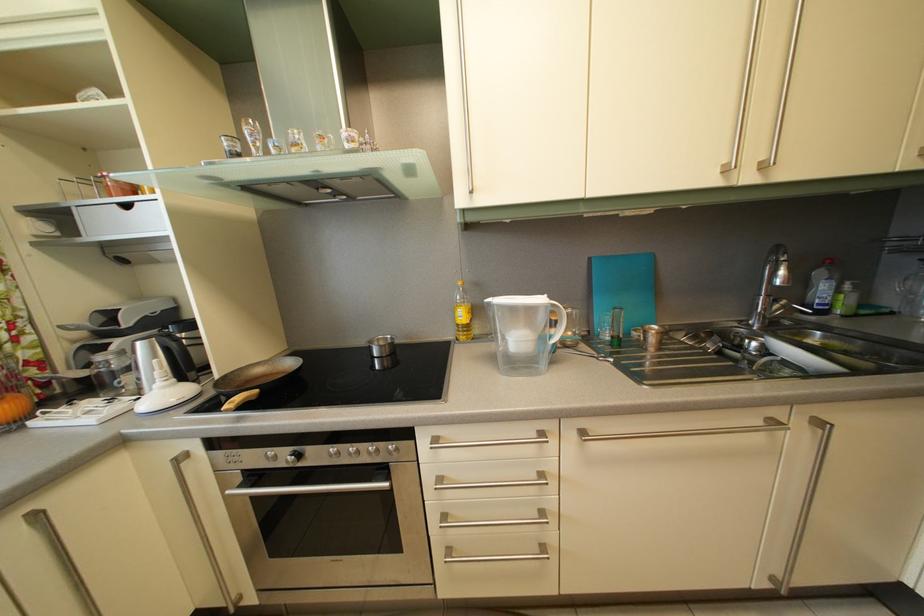
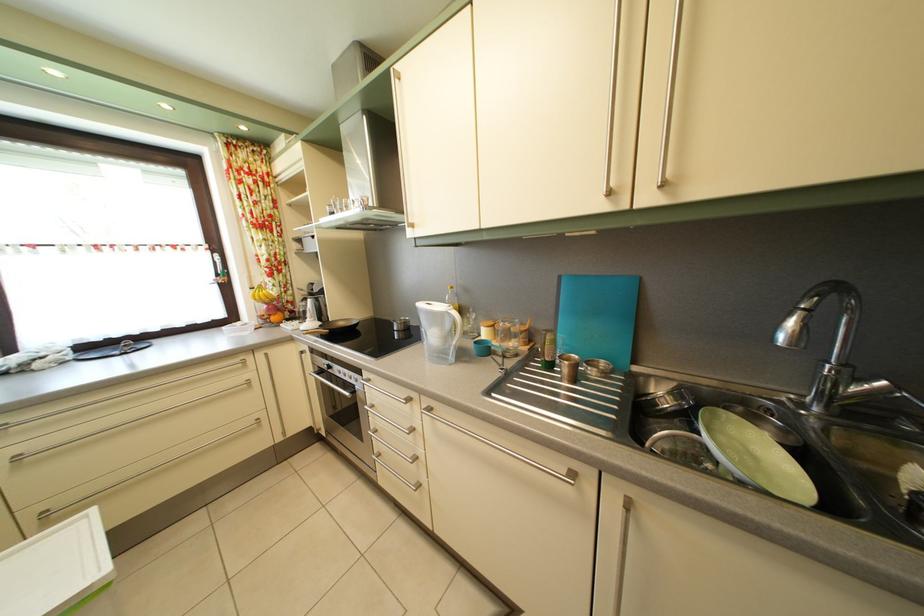
Where in the second image is the point corresponding to [399,454] from the first image?

(365, 384)